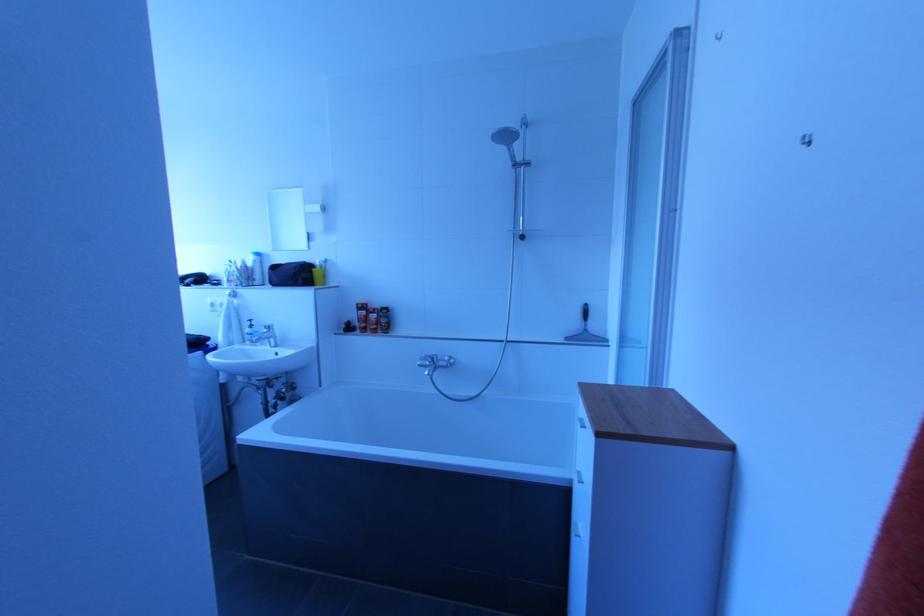
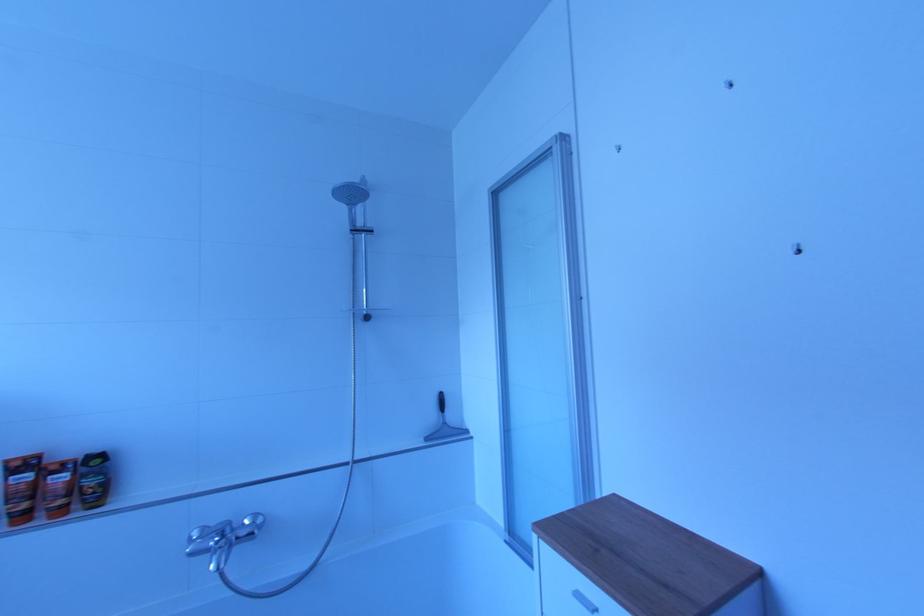
Question: How did the camera likely rotate?

Choices:
 (A) Left
 (B) Right
 (C) Up
 (D) Down

Answer: (B)